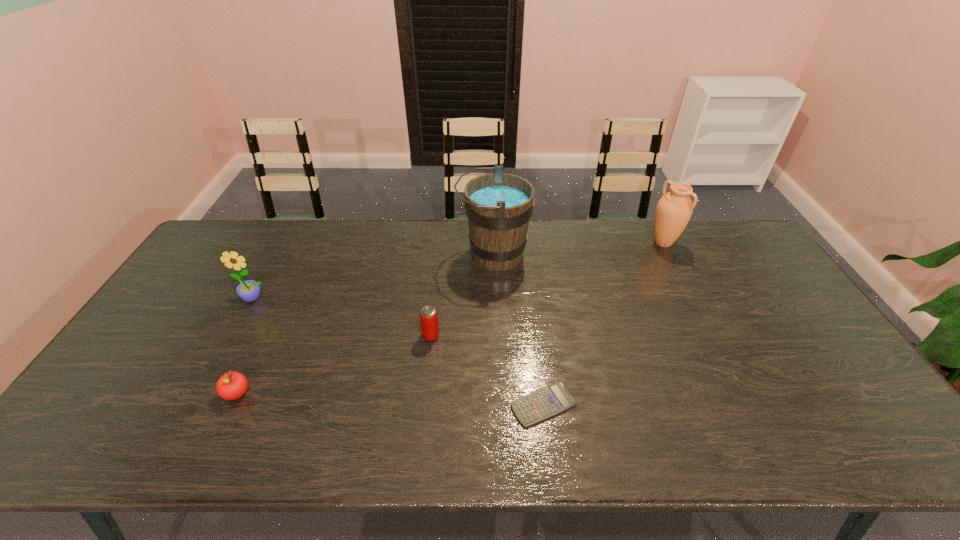
Image resolution: width=960 pixels, height=540 pixels. What are the coordinates of `vacant space situated with a handle on the side of the wine bucket` in the screenshot? It's located at (397, 254).

Where is `vacant space located with a handle on the side of the wine bucket`? The image size is (960, 540). vacant space located with a handle on the side of the wine bucket is located at coordinates (442, 254).

You are a GUI agent. You are given a task and a screenshot of the screen. Output one action in this format:
    pyautogui.click(x=<x>, y=<y>)
    Task: Click on the vacant space located 0.370m with a handle on the side of the wine bucket
    
    Given the screenshot: What is the action you would take?
    pyautogui.click(x=348, y=254)

This screenshot has width=960, height=540. Identify the location of blank space located 0.090m on the right of the urn. (705, 243).

At what (x,y) coordinates should I click in order to perform the action: click on free space located on the front-facing side of the fourth nearest object. Please return your answer as a coordinate pair (x, y). Image resolution: width=960 pixels, height=540 pixels. Looking at the image, I should click on (242, 320).

Identify the location of vacant region located 0.070m on the left of the beer can. The image size is (960, 540). pos(396,335).

Identify the location of blank space located 0.080m on the front of the fifth object from right to left. (217, 436).

Locate an element on the screen. This screenshot has height=540, width=960. free point located on the back of the shortest object is located at coordinates (538, 354).

Locate an element on the screen. wine bucket that is at the far edge is located at coordinates (498, 205).

The width and height of the screenshot is (960, 540). In order to click on urn that is positioned at the far edge in this screenshot , I will do `click(673, 212)`.